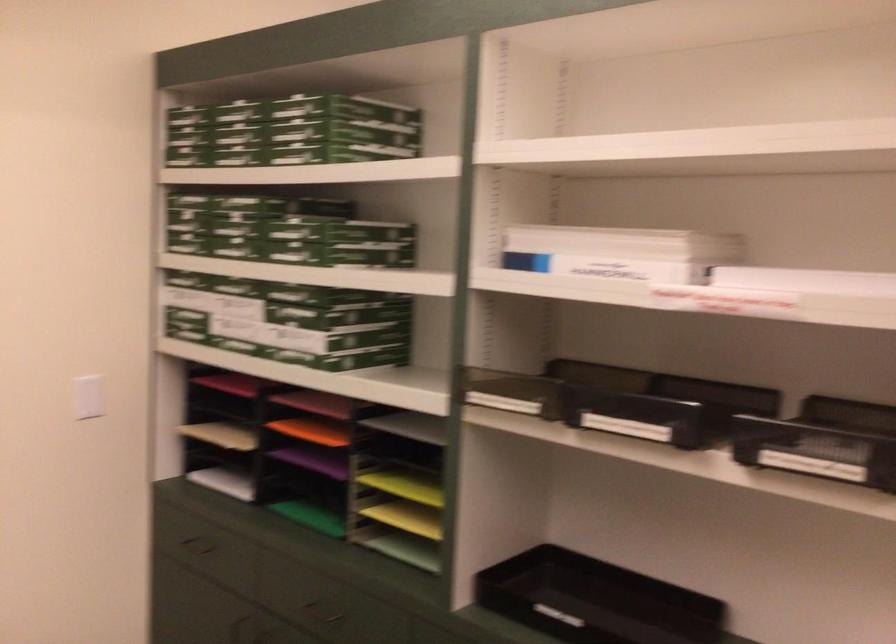
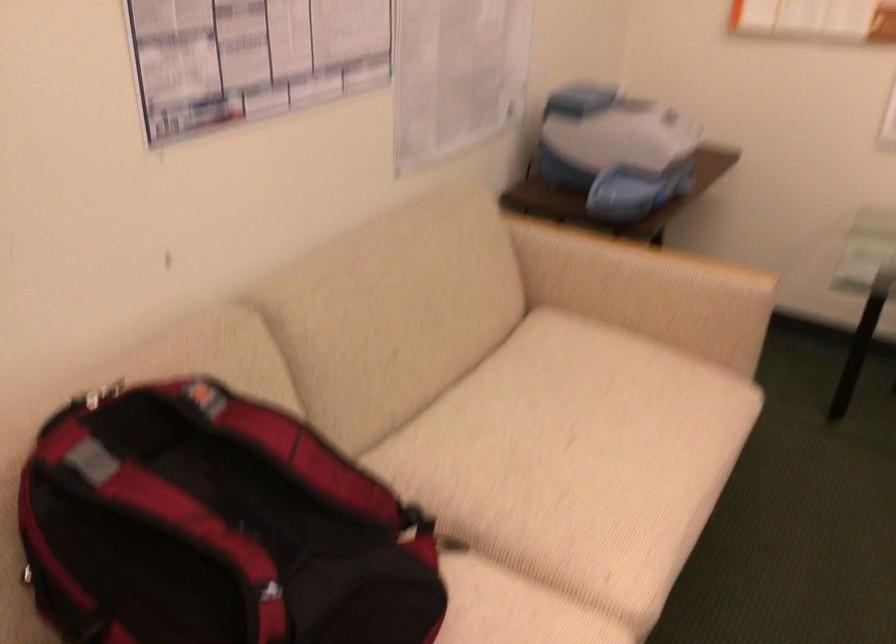
The images are taken continuously from a first-person perspective. In which direction is your viewpoint rotating?

The camera rotated toward left-down.